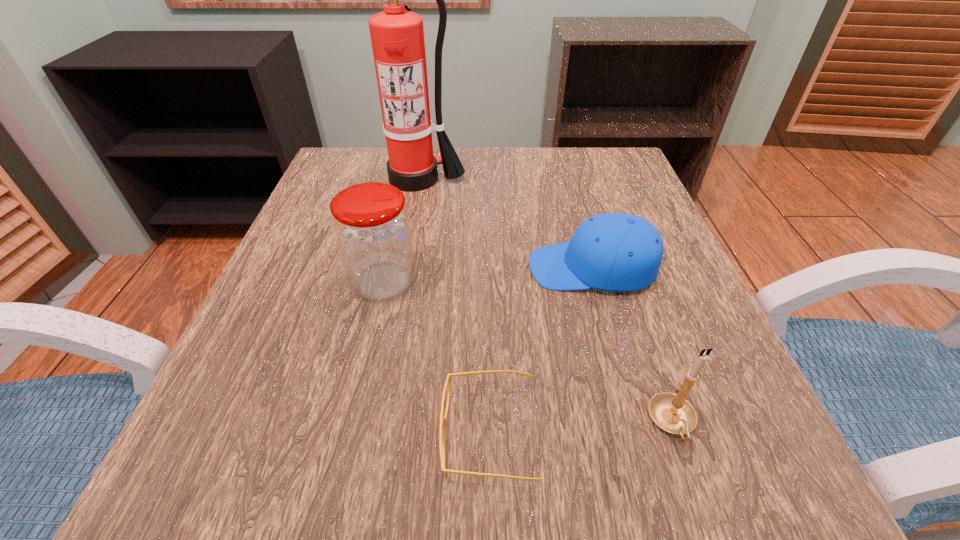
At what (x,y) coordinates should I click in order to perform the action: click on cap that is at the right edge. Please return your answer as a coordinate pair (x, y). Looking at the image, I should click on (619, 252).

Locate an element on the screen. object situated at the far left corner is located at coordinates (397, 36).

This screenshot has width=960, height=540. I want to click on object that is at the near right corner, so click(x=671, y=412).

Locate an element on the screen. The image size is (960, 540). vacant space at the far edge of the desktop is located at coordinates (549, 188).

Image resolution: width=960 pixels, height=540 pixels. I want to click on vacant space at the near edge of the desktop, so click(573, 498).

Find the location of a particular element. vacant region at the left edge of the desktop is located at coordinates (323, 300).

Find the location of a particular element. This screenshot has height=540, width=960. free space at the right edge is located at coordinates (626, 207).

Where is `free point at the far left corner`? The height and width of the screenshot is (540, 960). free point at the far left corner is located at coordinates (333, 184).

Find the location of a particular element. The image size is (960, 540). vacant space at the far right corner is located at coordinates (621, 149).

Where is `vacant space at the near right corner of the desktop`? Image resolution: width=960 pixels, height=540 pixels. vacant space at the near right corner of the desktop is located at coordinates (740, 450).